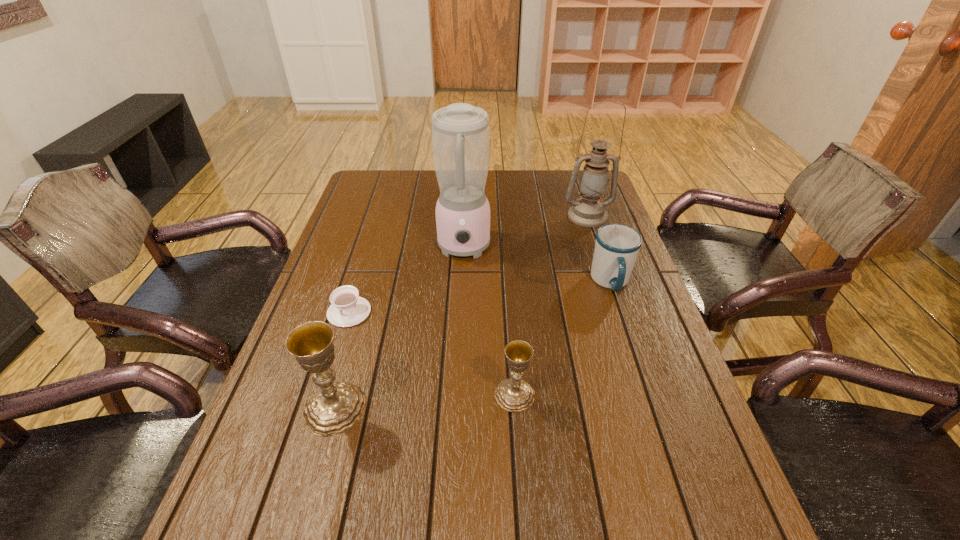
Identify the location of the taller chalice. This screenshot has width=960, height=540. (334, 407).

At what (x,y) coordinates should I click in order to perform the action: click on the fourth shortest object. Please return your answer as a coordinate pair (x, y). This screenshot has width=960, height=540. Looking at the image, I should click on (334, 407).

Find the location of a particular element. The width and height of the screenshot is (960, 540). the third object from right to left is located at coordinates (513, 394).

Image resolution: width=960 pixels, height=540 pixels. I want to click on the shorter chalice, so click(x=513, y=394).

At what (x,y) coordinates should I click in order to perform the action: click on food processor. Please return your answer as a coordinate pair (x, y). Image resolution: width=960 pixels, height=540 pixels. Looking at the image, I should click on (460, 132).

Find the location of a particular element. mug is located at coordinates (617, 245).

Image resolution: width=960 pixels, height=540 pixels. In order to click on oil lamp in this screenshot , I will do `click(589, 211)`.

At what (x,y) coordinates should I click in order to perform the action: click on the shortest object. Please return your answer as a coordinate pair (x, y). The height and width of the screenshot is (540, 960). Looking at the image, I should click on (347, 308).

The height and width of the screenshot is (540, 960). I want to click on vacant space positioned on the back of the taller chalice, so click(x=361, y=315).

Find the location of `vacant position located on the right of the shorter chalice`. vacant position located on the right of the shorter chalice is located at coordinates (586, 395).